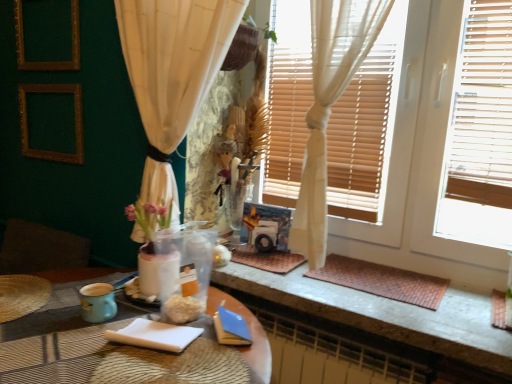
Question: Can you confirm if brown woven mat at lower right is shorter than white wood window frame at upper right?

Choices:
 (A) no
 (B) yes

Answer: (B)

Question: Considering the relative positions of brown woven mat at lower right and white wood window frame at upper right in the image provided, is brown woven mat at lower right in front of white wood window frame at upper right?

Choices:
 (A) no
 (B) yes

Answer: (A)

Question: Is brown woven mat at lower right thinner than white wood window frame at upper right?

Choices:
 (A) no
 (B) yes

Answer: (A)

Question: Is brown woven mat at lower right further to camera compared to white wood window frame at upper right?

Choices:
 (A) yes
 (B) no

Answer: (A)

Question: Is brown woven mat at lower right far from white wood window frame at upper right?

Choices:
 (A) yes
 (B) no

Answer: (B)

Question: From a real-world perspective, relative to white paper notepad at lower center, is gold textured picture frame at upper left, the 2th picture frame from the top, vertically above or below?

Choices:
 (A) below
 (B) above

Answer: (B)

Question: Does point (23, 140) appear closer or farther from the camera than point (129, 337)?

Choices:
 (A) closer
 (B) farther

Answer: (B)

Question: From the image's perspective, is gold textured picture frame at upper left, the 1th picture frame when ordered from bottom to top, above or below white paper notepad at lower center?

Choices:
 (A) below
 (B) above

Answer: (B)

Question: Choose the correct answer: Is gold textured picture frame at upper left, the 2th picture frame from the top, inside white paper notepad at lower center or outside it?

Choices:
 (A) outside
 (B) inside

Answer: (A)

Question: Considering the positions of gold textured picture frame at upper left, the 1th picture frame when ordered from bottom to top, and teal ceramic mug at lower left in the image, is gold textured picture frame at upper left, the 1th picture frame when ordered from bottom to top, taller or shorter than teal ceramic mug at lower left?

Choices:
 (A) tall
 (B) short

Answer: (A)

Question: In the image, is gold textured picture frame at upper left, the 1th picture frame when ordered from bottom to top, positioned in front of or behind teal ceramic mug at lower left?

Choices:
 (A) front
 (B) behind

Answer: (B)

Question: Is gold textured picture frame at upper left, the 1th picture frame when ordered from bottom to top, wider or thinner than teal ceramic mug at lower left?

Choices:
 (A) thin
 (B) wide

Answer: (A)

Question: Is point (32, 84) closer or farther from the camera than point (102, 286)?

Choices:
 (A) closer
 (B) farther

Answer: (B)

Question: From the image's perspective, is white wood window frame at upper right above or below white paper notepad at lower center?

Choices:
 (A) below
 (B) above

Answer: (B)

Question: Relative to white paper notepad at lower center, is white wood window frame at upper right in front or behind?

Choices:
 (A) front
 (B) behind

Answer: (A)